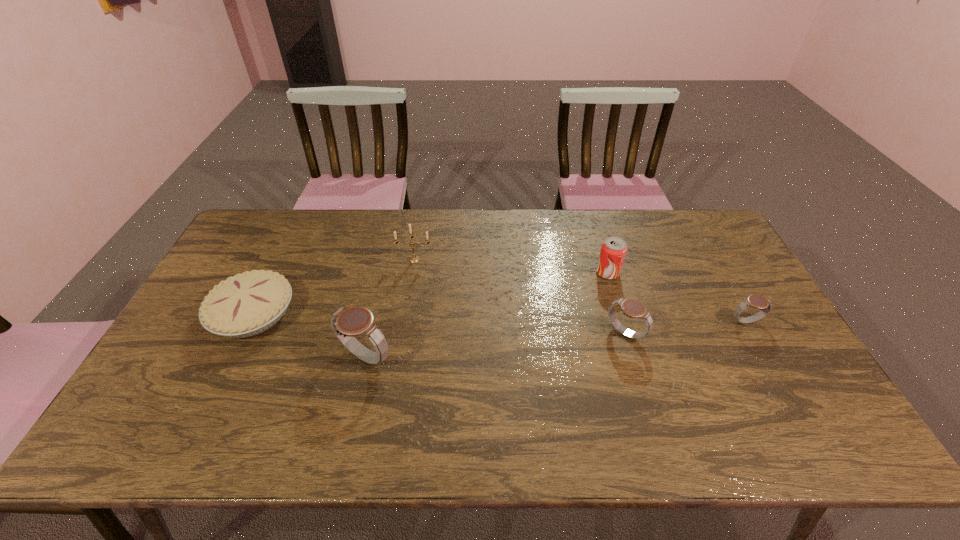
This screenshot has height=540, width=960. I want to click on free location located 0.240m on the back of the pie, so click(291, 235).

Locate an element on the screen. The image size is (960, 540). vacant area situated on the left of the second farthest object is located at coordinates (517, 273).

Identify the location of vacant space located on the front of the farthest object. (407, 305).

Locate an element on the screen. The height and width of the screenshot is (540, 960). object that is positioned at the left edge is located at coordinates (247, 304).

Image resolution: width=960 pixels, height=540 pixels. Find the location of `object positioned at the right edge`. object positioned at the right edge is located at coordinates (764, 304).

This screenshot has width=960, height=540. I want to click on vacant region at the far edge, so click(379, 210).

The width and height of the screenshot is (960, 540). In order to click on free point at the near edge in this screenshot , I will do `click(423, 387)`.

Where is `free space at the right edge of the desktop`? Image resolution: width=960 pixels, height=540 pixels. free space at the right edge of the desktop is located at coordinates (737, 327).

In the image, there is a desktop. Find the location of `vacant space at the far left corner`. vacant space at the far left corner is located at coordinates point(254,215).

The width and height of the screenshot is (960, 540). In order to click on free point at the near right corner in this screenshot , I will do `click(798, 382)`.